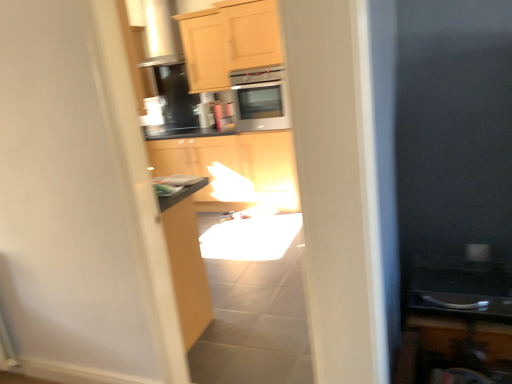
Question: Would you say light wood cabinet at upper center, placed as the second cabinetry when sorted from right to left, is to the left or to the right of matte wood cabinet at center, marked as the 2th cabinetry in a bottom-to-top arrangement, in the picture?

Choices:
 (A) left
 (B) right

Answer: (B)

Question: Considering the positions of light wood cabinet at upper center, acting as the second cabinetry starting from the back, and matte wood cabinet at center, acting as the 1th cabinetry starting from the left, in the image, is light wood cabinet at upper center, acting as the second cabinetry starting from the back, wider or thinner than matte wood cabinet at center, acting as the 1th cabinetry starting from the left,?

Choices:
 (A) wide
 (B) thin

Answer: (A)

Question: Which object is positioned closest to the satin silver microwave at center?

Choices:
 (A) matte wood cabinet at center, which appears as the second cabinetry when viewed from the top
 (B) light wood cabinet at upper center, marked as the 1th cabinetry in a top-to-bottom arrangement
 (C) wooden cabinet at lower right, arranged as the first cabinetry when viewed from the right

Answer: (B)

Question: Which object is positioned closest to the satin silver microwave at center?

Choices:
 (A) light wood cabinet at upper center, acting as the second cabinetry starting from the back
 (B) matte wood cabinet at center, arranged as the 3th cabinetry when viewed from the right
 (C) wooden cabinet at lower right, the first cabinetry from the bottom

Answer: (A)